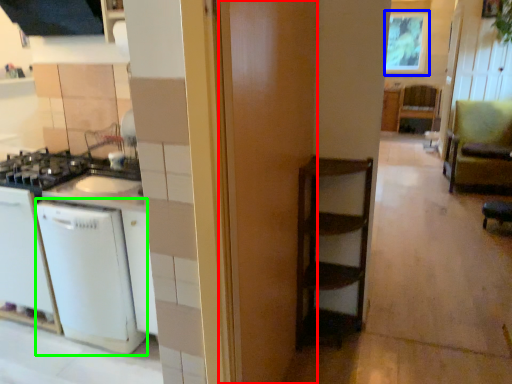
Question: Considering the real-world distances, which object is closest to door (highlighted by a red box)? window screen (highlighted by a blue box) or dish washer (highlighted by a green box).

Choices:
 (A) window screen
 (B) dish washer

Answer: (B)